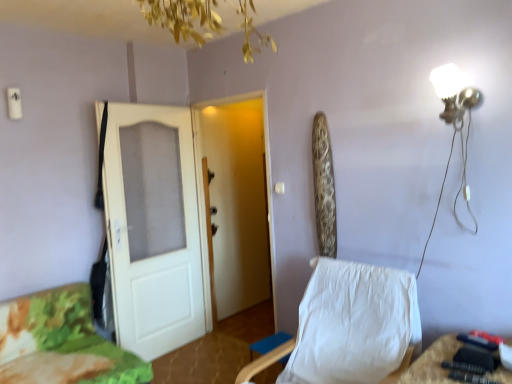
Locate an element on the screen. The image size is (512, 384). vacant area that is in front of white wooden door at center, the 1th door positioned from the right is located at coordinates (229, 362).